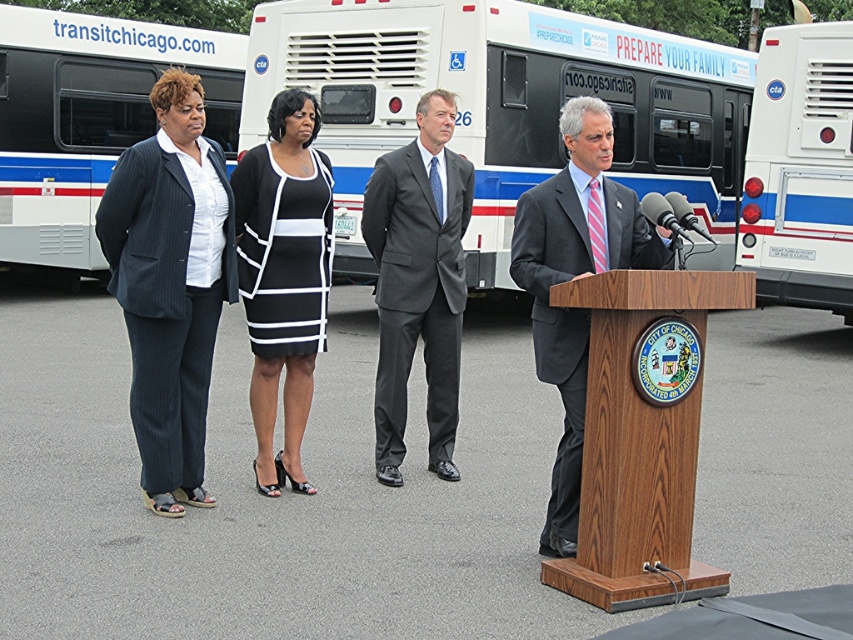
Can you confirm if black and white striped dress at center is bigger than matte gray suit at center?

No, black and white striped dress at center is not bigger than matte gray suit at center.

Does black and white striped dress at center come behind matte gray suit at center?

Yes, it is behind matte gray suit at center.

Who is more forward, (322, 228) or (581, 196)?

Positioned in front is point (581, 196).

The image size is (853, 640). I want to click on black and white striped dress at center, so click(x=283, y=275).

Which is more to the right, wooden podium at center or dark gray suit at center?

From the viewer's perspective, wooden podium at center appears more on the right side.

How distant is wooden podium at center from dark gray suit at center?

5.66 feet

Who is more forward, (619, 280) or (457, 188)?

Point (619, 280)

Identify the location of wooden podium at center. (640, 442).

Who is taller, white plastic bus at left or white plastic bus at right?

Standing taller between the two is white plastic bus at left.

Does point (119, 68) lie behind point (746, 209)?

Yes, point (119, 68) is farther from viewer.

Locate an element on the screen. Image resolution: width=853 pixels, height=640 pixels. white plastic bus at left is located at coordinates (90, 118).